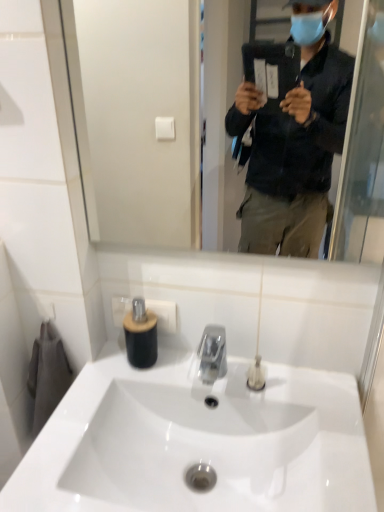
At what (x,y) coordinates should I click in order to perform the action: click on free space to the right of clear plastic tube at center, which ranks as the 2th toiletry in left-to-right order. Please return your answer as a coordinate pair (x, y). Image resolution: width=384 pixels, height=512 pixels. Looking at the image, I should click on (315, 390).